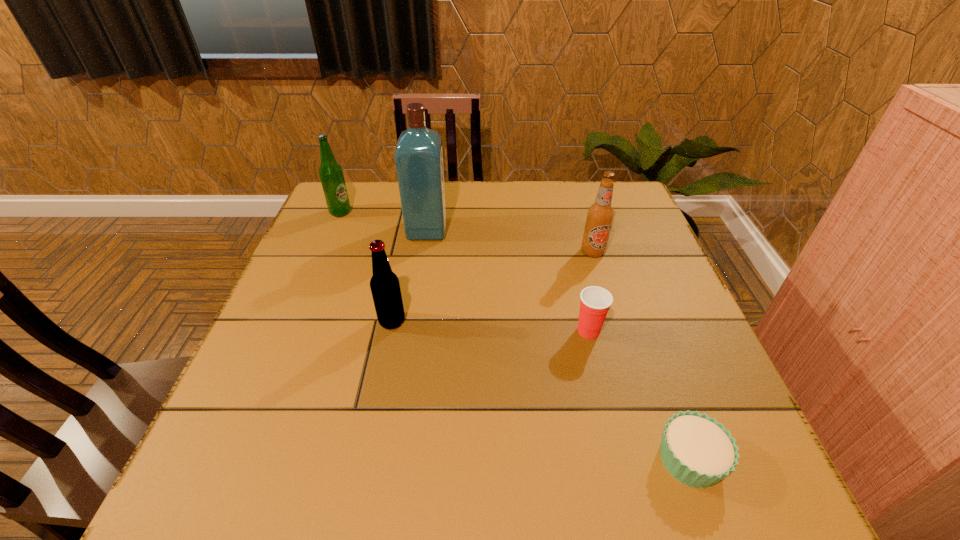
Image resolution: width=960 pixels, height=540 pixels. I want to click on the second farthest object, so [x=419, y=153].

I want to click on liquor, so click(419, 153).

This screenshot has height=540, width=960. In order to click on the farthest object in this screenshot , I will do `click(331, 175)`.

This screenshot has height=540, width=960. In order to click on the leftmost beer bottle in this screenshot , I will do `click(331, 175)`.

You are a GUI agent. You are given a task and a screenshot of the screen. Output one action in this format:
    pyautogui.click(x=<x>, y=<y>)
    Task: Click on the second nearest beer bottle
    This screenshot has height=540, width=960.
    Given the screenshot: What is the action you would take?
    pyautogui.click(x=600, y=215)

This screenshot has height=540, width=960. I want to click on the third farthest object, so click(x=600, y=215).

Locate an element on the screen. The height and width of the screenshot is (540, 960). the nearest beer bottle is located at coordinates (385, 288).

I want to click on Dixie cup, so click(x=595, y=302).

You are a GUI agent. You are given a task and a screenshot of the screen. Output one action in this format:
    pyautogui.click(x=<x>, y=<y>)
    Task: Click on the cupcake
    
    Given the screenshot: What is the action you would take?
    pyautogui.click(x=697, y=450)

At what (x,y) coordinates should I click in order to perform the action: click on the shortest object. Please return your answer as a coordinate pair (x, y). This screenshot has height=540, width=960. Looking at the image, I should click on (697, 450).